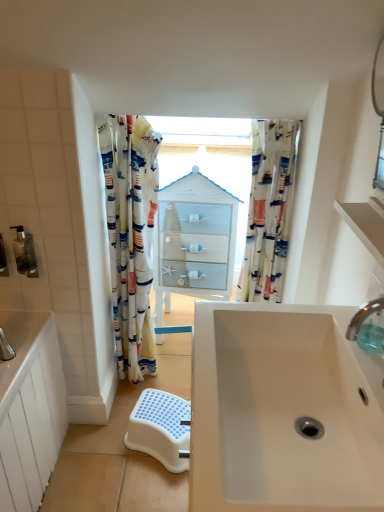
Question: Considering the relative sizes of printed fabric curtain at center, acting as the 2th curtain starting from the left, and white glossy cabinet at center in the image provided, is printed fabric curtain at center, acting as the 2th curtain starting from the left, shorter than white glossy cabinet at center?

Choices:
 (A) yes
 (B) no

Answer: (A)

Question: Is printed fabric curtain at center, marked as the first curtain in a right-to-left arrangement, taller than white glossy cabinet at center?

Choices:
 (A) no
 (B) yes

Answer: (A)

Question: Is white glossy cabinet at center at the back of printed fabric curtain at center, marked as the first curtain in a right-to-left arrangement?

Choices:
 (A) no
 (B) yes

Answer: (A)

Question: Considering the relative positions of printed fabric curtain at center, marked as the first curtain in a right-to-left arrangement, and white glossy cabinet at center in the image provided, is printed fabric curtain at center, marked as the first curtain in a right-to-left arrangement, to the right of white glossy cabinet at center from the viewer's perspective?

Choices:
 (A) no
 (B) yes

Answer: (B)

Question: Is white glossy cabinet at center located within printed fabric curtain at center, acting as the 2th curtain starting from the left?

Choices:
 (A) yes
 (B) no

Answer: (B)

Question: Is point (254, 140) closer or farther from the camera than point (114, 274)?

Choices:
 (A) farther
 (B) closer

Answer: (B)

Question: Based on their sizes in the image, would you say printed fabric curtain at center, marked as the first curtain in a right-to-left arrangement, is bigger or smaller than printed fabric shower curtain at left, placed as the 1th curtain when sorted from left to right?

Choices:
 (A) big
 (B) small

Answer: (B)

Question: From a real-world perspective, relative to printed fabric shower curtain at left, the second curtain positioned from the right, is printed fabric curtain at center, marked as the first curtain in a right-to-left arrangement, vertically above or below?

Choices:
 (A) below
 (B) above

Answer: (B)

Question: Which is correct: printed fabric curtain at center, acting as the 2th curtain starting from the left, is inside printed fabric shower curtain at left, the second curtain positioned from the right, or outside of it?

Choices:
 (A) outside
 (B) inside

Answer: (A)

Question: Visually, is white matte shelf at upper right positioned to the left or to the right of clear plastic tap at upper right?

Choices:
 (A) right
 (B) left

Answer: (A)

Question: Considering the positions of white matte shelf at upper right and clear plastic tap at upper right in the image, is white matte shelf at upper right taller or shorter than clear plastic tap at upper right?

Choices:
 (A) tall
 (B) short

Answer: (B)

Question: In terms of width, does white matte shelf at upper right look wider or thinner when compared to clear plastic tap at upper right?

Choices:
 (A) wide
 (B) thin

Answer: (A)

Question: Considering their positions, is white matte shelf at upper right located in front of or behind clear plastic tap at upper right?

Choices:
 (A) behind
 (B) front

Answer: (B)

Question: Considering the positions of white plastic step stool at lower center and printed fabric curtain at center, acting as the 2th curtain starting from the left, in the image, is white plastic step stool at lower center wider or thinner than printed fabric curtain at center, acting as the 2th curtain starting from the left,?

Choices:
 (A) wide
 (B) thin

Answer: (A)

Question: Is white plastic step stool at lower center to the left or to the right of printed fabric curtain at center, marked as the first curtain in a right-to-left arrangement, in the image?

Choices:
 (A) left
 (B) right

Answer: (A)